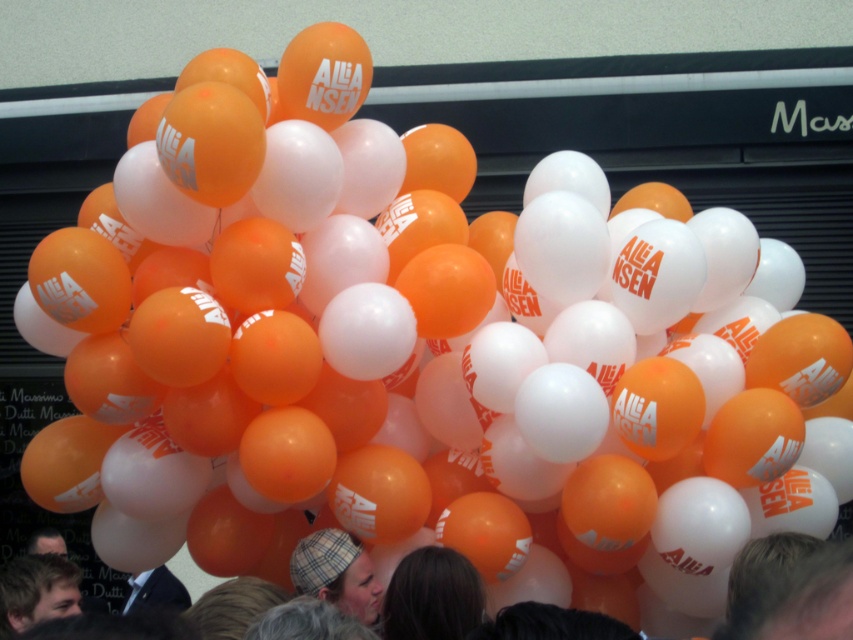
Question: Is the position of orange matte balloons at center less distant than that of dark brown hair at lower center?

Choices:
 (A) no
 (B) yes

Answer: (B)

Question: Which point is closer to the camera?

Choices:
 (A) orange matte balloons at center
 (B) dark brown hair at lower center
 (C) plaid fabric hat at center
 (D) light brown hair at lower left

Answer: (A)

Question: Which point appears farthest from the camera in this image?

Choices:
 (A) (426, 625)
 (B) (47, 531)
 (C) (364, 582)

Answer: (B)

Question: Which of the following is the closest to the observer?

Choices:
 (A) (344, 563)
 (B) (28, 618)
 (C) (91, 634)
 (D) (56, 548)

Answer: (C)

Question: Considering the relative positions of light brown hair at lower left and dark hair at center in the image provided, where is light brown hair at lower left located with respect to dark hair at center?

Choices:
 (A) right
 (B) left

Answer: (A)

Question: Is dark brown hair at lower center smaller than dark hair at center?

Choices:
 (A) no
 (B) yes

Answer: (A)